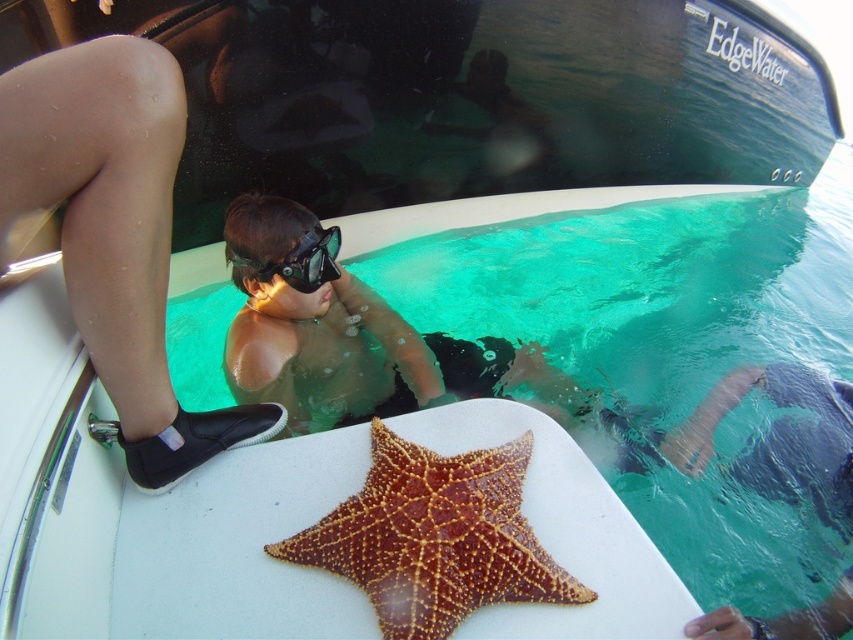
Question: Can you confirm if brown spiny starfish at center is smaller than black matte goggles at center?

Choices:
 (A) yes
 (B) no

Answer: (B)

Question: Which point appears closest to the camera in this image?

Choices:
 (A) (479, 556)
 (B) (287, 262)

Answer: (A)

Question: Does brown spiny starfish at center appear on the left side of black matte goggles at center?

Choices:
 (A) yes
 (B) no

Answer: (B)

Question: Among these points, which one is nearest to the camera?

Choices:
 (A) (334, 272)
 (B) (326, 525)

Answer: (B)

Question: Is brown spiny starfish at center smaller than black matte goggles at center?

Choices:
 (A) yes
 (B) no

Answer: (B)

Question: Among these objects, which one is nearest to the camera?

Choices:
 (A) black matte goggles at center
 (B) brown spiny starfish at center

Answer: (B)